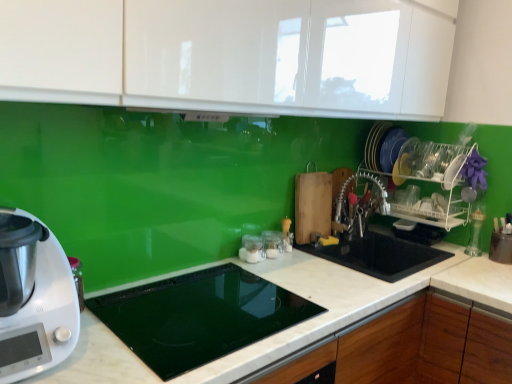
I want to click on free point to the right of clear glass jar at center, marked as the 2th appliance in a back-to-front arrangement, so click(x=297, y=265).